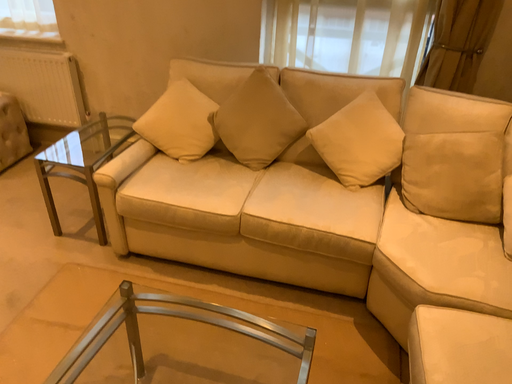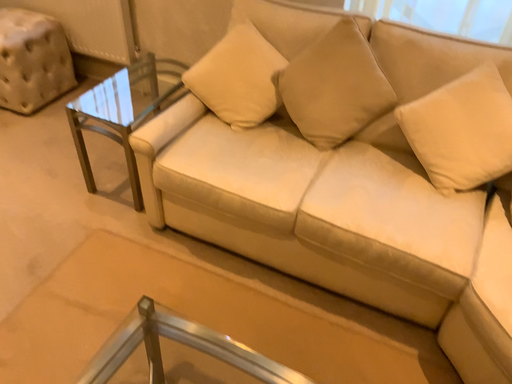
Question: Which way did the camera rotate in the video?

Choices:
 (A) rotated right
 (B) rotated left

Answer: (B)